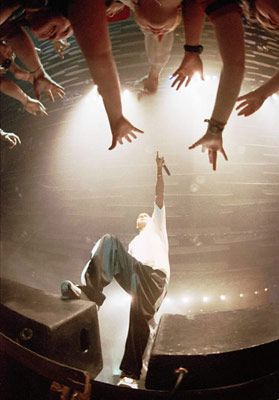
Identify the location of right speaker. Image resolution: width=279 pixels, height=400 pixels. (186, 334).